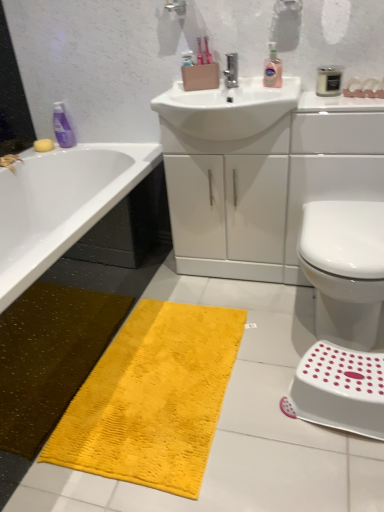
At what (x,y) coordinates should I click in order to perform the action: click on free space to the left of white glossy bidet at lower right. Please return your answer as a coordinate pair (x, y). The image size is (384, 512). Looking at the image, I should click on (260, 338).